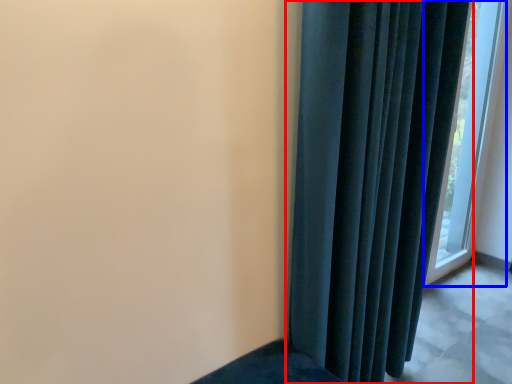
Question: Which object appears farthest to the camera in this image, curtain (highlighted by a red box) or window (highlighted by a blue box)?

Choices:
 (A) curtain
 (B) window

Answer: (B)